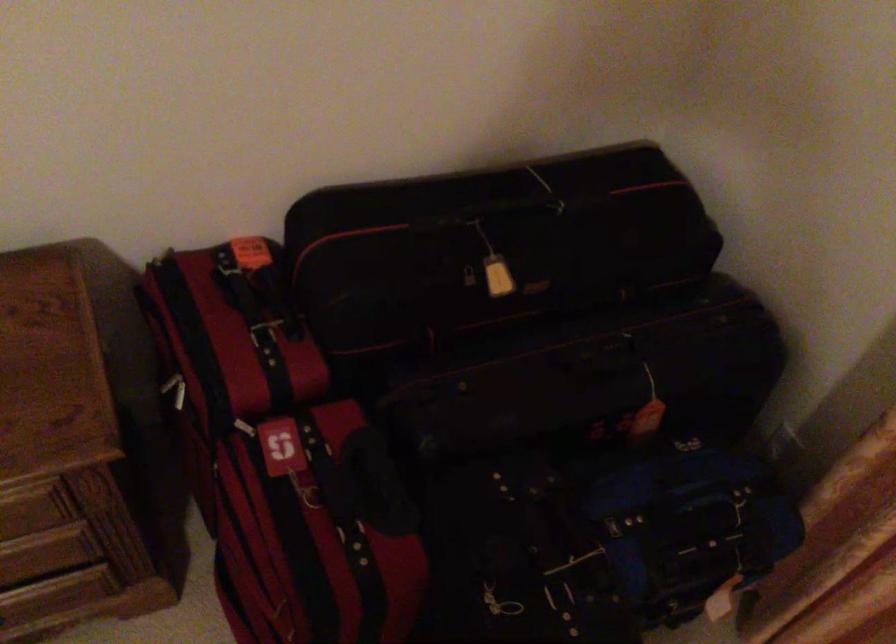
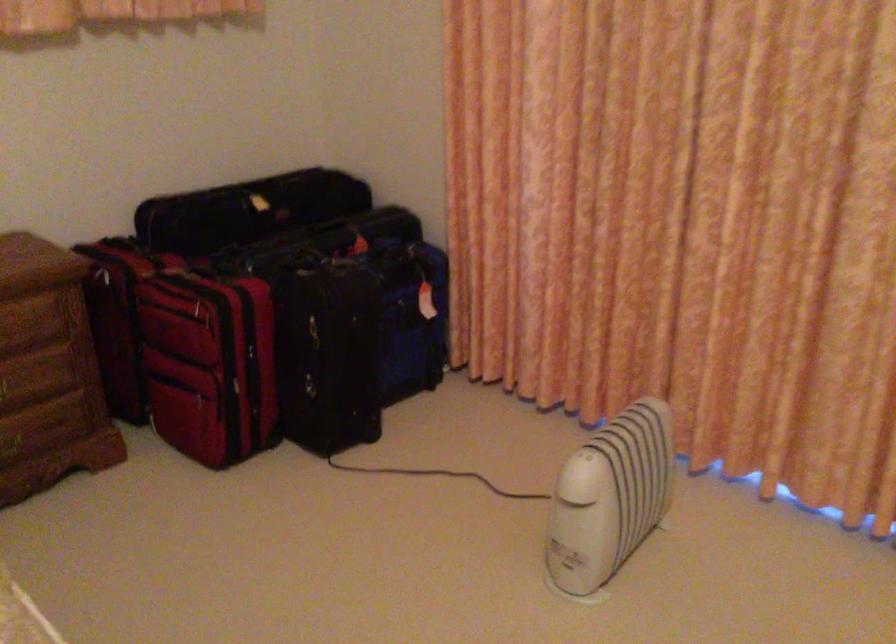
Where in the second image is the point corresponding to the point at 464,285 from the first image?

(247, 210)